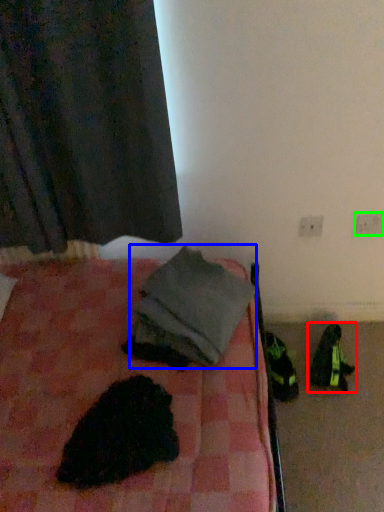
Question: Which object is the closest to the footwear (highlighted by a red box)? Choose among these: clothing (highlighted by a blue box) or electric outlet (highlighted by a green box).

Choices:
 (A) clothing
 (B) electric outlet

Answer: (B)